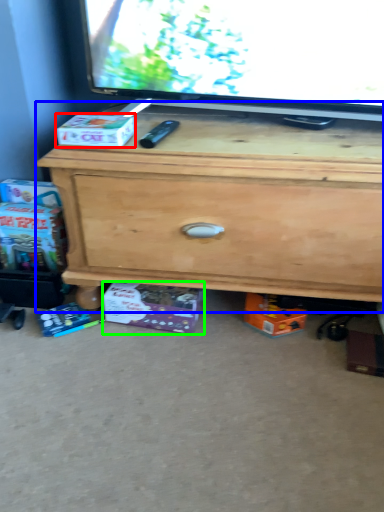
Question: Based on their relative distances, which object is farther from box (highlighted by a red box)? Choose from chest of drawers (highlighted by a blue box) and box (highlighted by a green box).

Choices:
 (A) chest of drawers
 (B) box

Answer: (B)